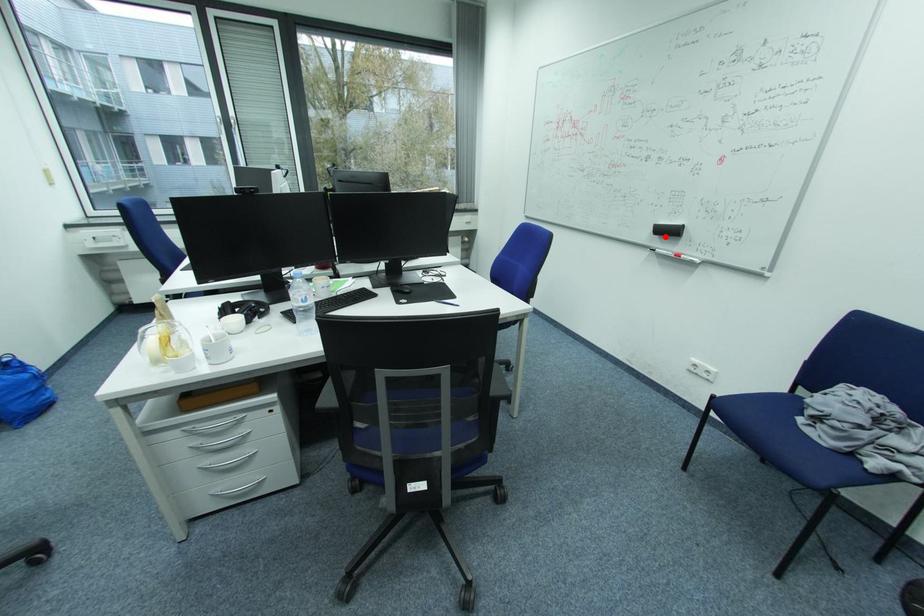
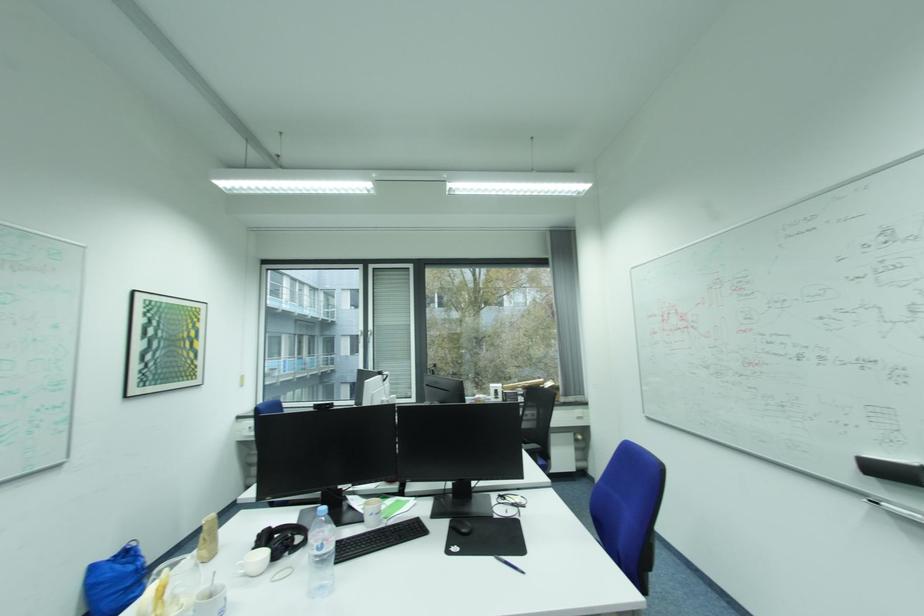
Locate, in the second image, the point that corresponds to the highlighted location in the first image.

(880, 477)